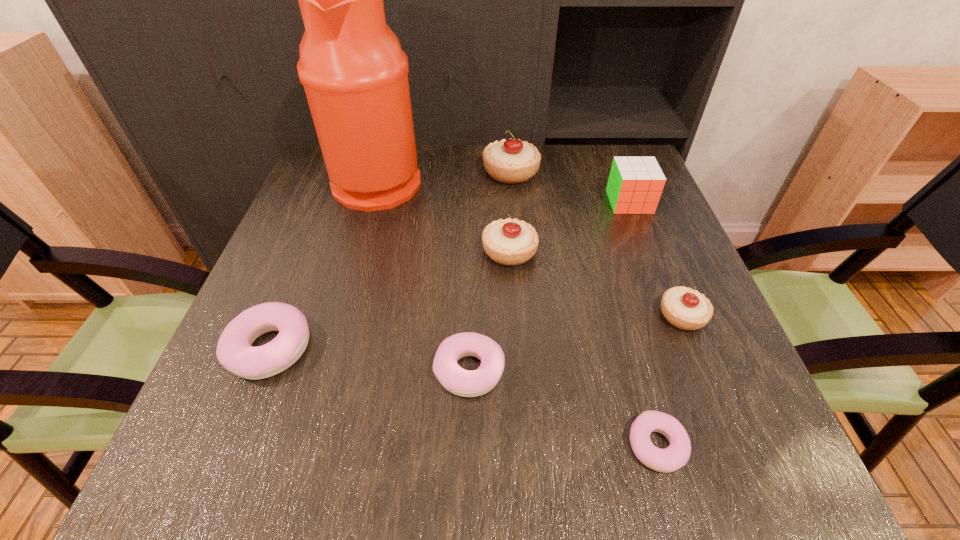
The width and height of the screenshot is (960, 540). Identify the location of the tallest object. (355, 74).

This screenshot has height=540, width=960. In order to click on orange water jug in this screenshot , I will do `click(355, 74)`.

Identify the location of the farthest beige pastry. The height and width of the screenshot is (540, 960). (511, 161).

The image size is (960, 540). Find the location of `the tallest pastry`. the tallest pastry is located at coordinates (511, 161).

Where is `cube`? The width and height of the screenshot is (960, 540). cube is located at coordinates pyautogui.click(x=635, y=185).

At what (x,y) coordinates should I click in order to perform the action: click on the second biggest beige pastry. Please return your answer as a coordinate pair (x, y). This screenshot has width=960, height=540. Looking at the image, I should click on (510, 242).

You are a GUI agent. You are given a task and a screenshot of the screen. Output one action in this format:
    pyautogui.click(x=<x>, y=<y>)
    Task: Click on the second farthest beige pastry
    The width and height of the screenshot is (960, 540).
    Given the screenshot: What is the action you would take?
    pyautogui.click(x=510, y=242)

The width and height of the screenshot is (960, 540). In order to click on the third tallest pastry in this screenshot , I will do `click(687, 309)`.

The image size is (960, 540). Find the location of `the smallest beige pastry`. the smallest beige pastry is located at coordinates (687, 309).

In order to click on the leftmost pastry in this screenshot , I will do `click(234, 351)`.